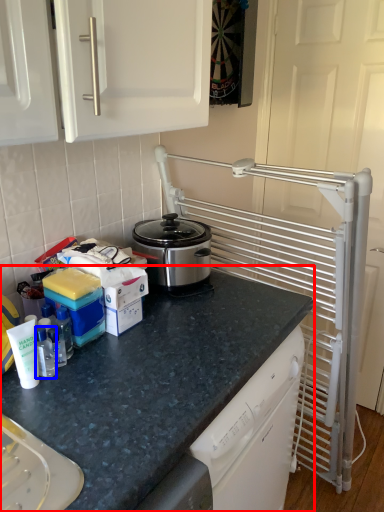
Question: Which of the following is the closest to the observer, countertop (highlighted by a red box) or bottle (highlighted by a blue box)?

Choices:
 (A) countertop
 (B) bottle

Answer: (A)